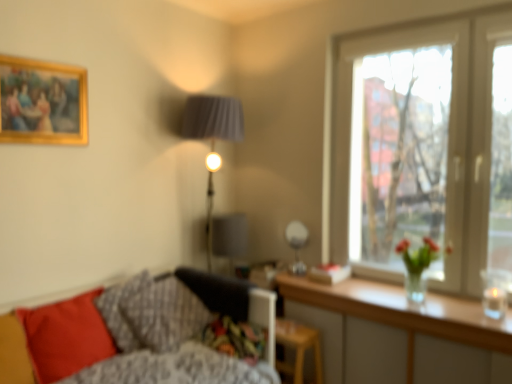
Find the location of `unoccupied space behind translucent glass candle at lower right`. unoccupied space behind translucent glass candle at lower right is located at coordinates (460, 304).